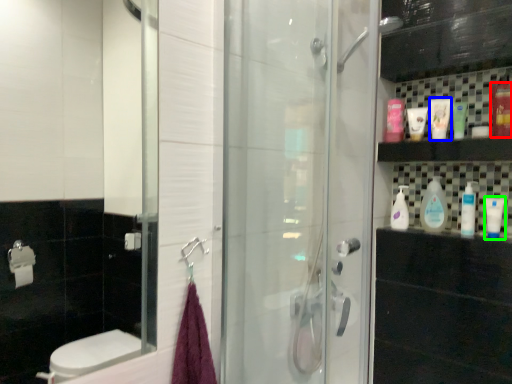
Question: Considering the real-world distances, which object is farthest from mouthwash (highlighted by a red box)? mouthwash (highlighted by a blue box) or mouthwash (highlighted by a green box)?

Choices:
 (A) mouthwash
 (B) mouthwash

Answer: (B)